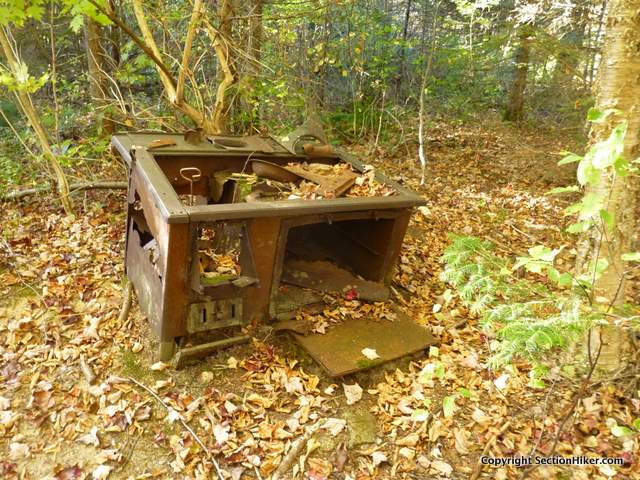
Locate an element on the screen. handle is located at coordinates (198, 176).